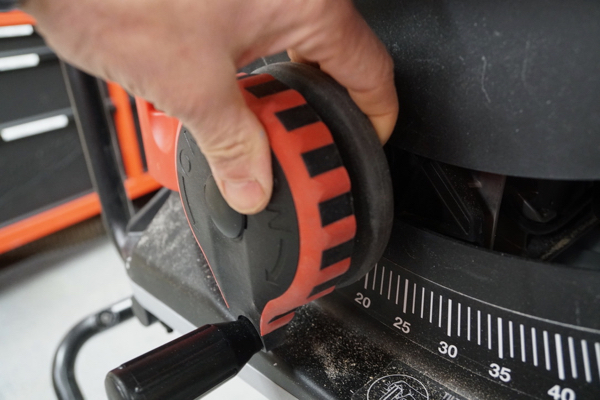
You are a GUI agent. You are given a task and a screenshot of the screen. Output one action in this format:
    pyautogui.click(x=<x>, y=<y>)
    Task: Click on the handle
    This screenshot has height=400, width=600.
    Given the screenshot: What is the action you would take?
    pyautogui.click(x=202, y=358)